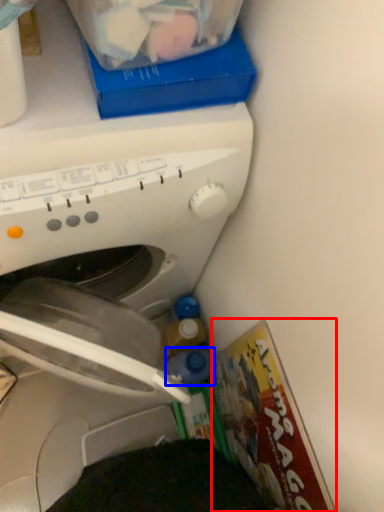
Question: Which object appears farthest to the camera in this image, magazine (highlighted by a red box) or bottle (highlighted by a blue box)?

Choices:
 (A) magazine
 (B) bottle

Answer: (B)